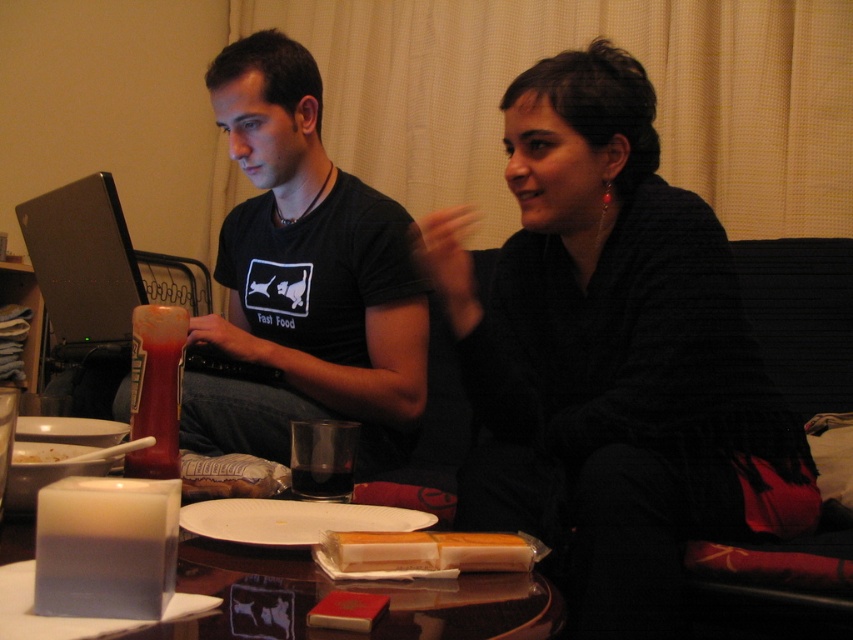
Question: Is black matte sweater at center above yellow cheese at center?

Choices:
 (A) yes
 (B) no

Answer: (A)

Question: Estimate the real-world distances between objects in this image. Which object is closer to the yellow cheese at center?

Choices:
 (A) black matte sweater at center
 (B) white paper plate at lower center
 (C) translucent glass cup at center

Answer: (C)

Question: Which of these objects is positioned closest to the silver metallic laptop at left?

Choices:
 (A) matte black shirt at center
 (B) translucent glass cup at center
 (C) white paper plate at lower center
 (D) yellow cheese at center

Answer: (A)

Question: Is black matte sweater at center below yellow cheese at center?

Choices:
 (A) yes
 (B) no

Answer: (B)

Question: Which point appears closest to the camera in this image?

Choices:
 (A) (590, 518)
 (B) (413, 538)
 (C) (277, 100)

Answer: (B)

Question: Does silver metallic laptop at left have a smaller size compared to white paper plate at lower center?

Choices:
 (A) yes
 (B) no

Answer: (B)